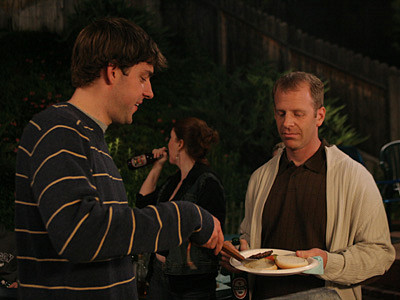
Image resolution: width=400 pixels, height=300 pixels. I want to click on bottle, so click(x=146, y=160).